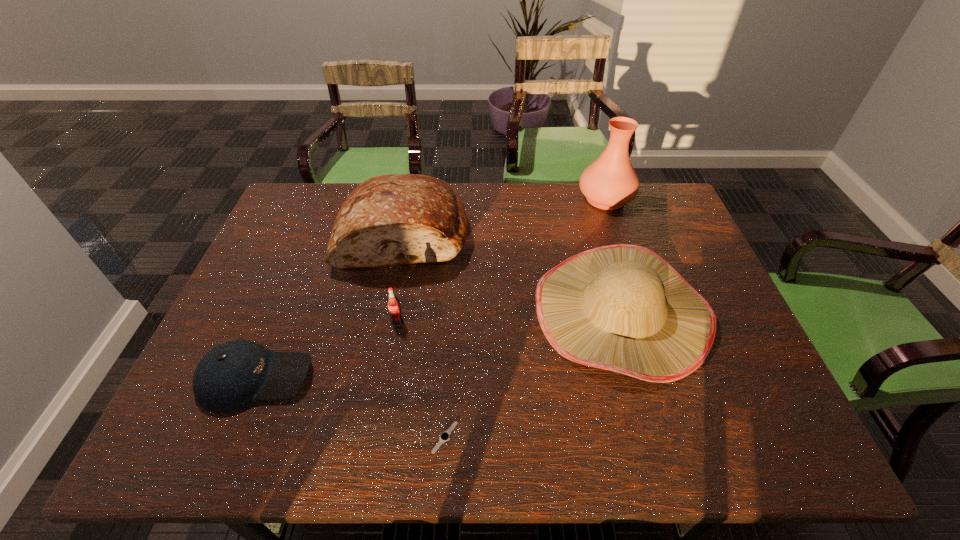
At what (x,y) coordinates should I click in order to perform the action: click on free space between the third shortest object and the fifth shortest object. Please return your answer as a coordinate pair (x, y). This screenshot has width=960, height=540. Looking at the image, I should click on (400, 278).

What are the coordinates of `free space between the fourth tallest object and the fifth shortest object` in the screenshot? It's located at (400, 278).

The image size is (960, 540). I want to click on free spot between the baseball cap and the second tallest object, so click(x=330, y=306).

Locate an element on the screen. The image size is (960, 540). vacant space that is in between the soda bottle and the vase is located at coordinates pos(501,260).

The height and width of the screenshot is (540, 960). What are the coordinates of `object that is the second closest one to the baseball cap` in the screenshot? It's located at (396, 219).

Identify which object is the third closest to the fourth shortest object. Please provide its 2D coordinates. Your answer should be formatted as a tuple, i.e. [(x, y)], where the tuple contains the x and y coordinates of a point satisfying the conditions above.

[(445, 436)]

This screenshot has height=540, width=960. Find the location of `vacant space that satisfies the following two spatial constraints: 1. at the sliced front of the bread; 2. on the right side of the sunhat`. vacant space that satisfies the following two spatial constraints: 1. at the sliced front of the bread; 2. on the right side of the sunhat is located at coordinates (390, 311).

At what (x,y) coordinates should I click in order to perform the action: click on vacant space that satisfies the following two spatial constraints: 1. on the label of the soda bottle; 2. on the front-facing side of the baseball cap. Please return your answer as a coordinate pair (x, y). Looking at the image, I should click on (388, 378).

This screenshot has height=540, width=960. In order to click on free space that satisfies the following two spatial constraints: 1. at the sliced front of the bread; 2. on the left side of the watch in this screenshot , I will do `click(367, 437)`.